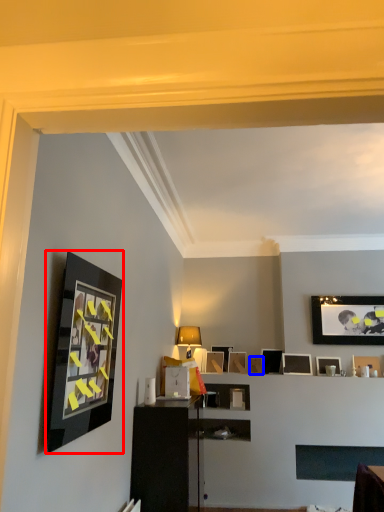
Question: Which object appears farthest to the camera in this image, picture frame (highlighted by a red box) or picture frame (highlighted by a blue box)?

Choices:
 (A) picture frame
 (B) picture frame

Answer: (B)